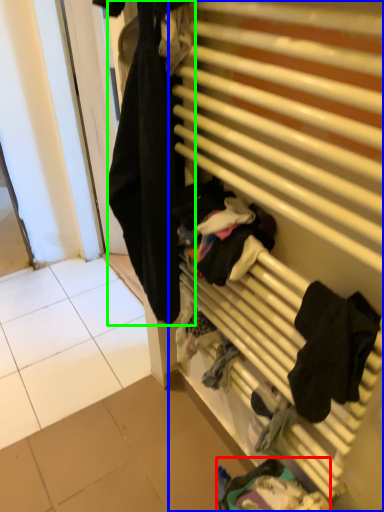
Question: Which object is positioned farthest from clothing (highlighted by a red box)? Select from furniture (highlighted by a blue box) and clothing (highlighted by a green box).

Choices:
 (A) furniture
 (B) clothing

Answer: (B)